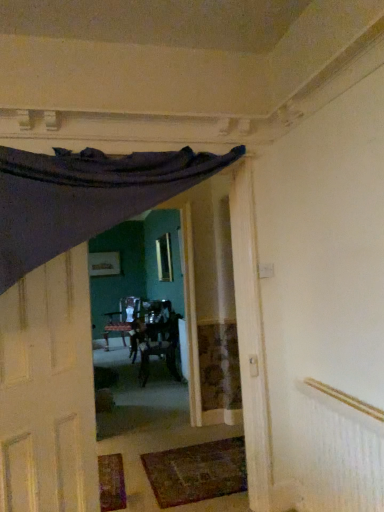
Question: Is matte white door at left surrounding wooden textured chair at center?

Choices:
 (A) yes
 (B) no

Answer: (B)

Question: Considering the relative sizes of matte white door at left and wooden textured chair at center in the image provided, is matte white door at left shorter than wooden textured chair at center?

Choices:
 (A) yes
 (B) no

Answer: (B)

Question: Considering the relative sizes of matte white door at left and wooden textured chair at center in the image provided, is matte white door at left smaller than wooden textured chair at center?

Choices:
 (A) no
 (B) yes

Answer: (B)

Question: From a real-world perspective, is matte white door at left on top of wooden textured chair at center?

Choices:
 (A) yes
 (B) no

Answer: (A)

Question: Does matte white door at left have a lesser width compared to wooden textured chair at center?

Choices:
 (A) yes
 (B) no

Answer: (A)

Question: From a real-world perspective, does matte white door at left sit lower than wooden textured chair at center?

Choices:
 (A) yes
 (B) no

Answer: (B)

Question: From a real-world perspective, is wooden textured chair at center over clear glass window at center?

Choices:
 (A) yes
 (B) no

Answer: (B)

Question: Can you confirm if wooden textured chair at center is taller than clear glass window at center?

Choices:
 (A) no
 (B) yes

Answer: (B)

Question: Is wooden textured chair at center in front of clear glass window at center?

Choices:
 (A) no
 (B) yes

Answer: (B)

Question: Is wooden textured chair at center outside of clear glass window at center?

Choices:
 (A) no
 (B) yes

Answer: (B)

Question: Considering the relative sizes of wooden textured chair at center and clear glass window at center in the image provided, is wooden textured chair at center thinner than clear glass window at center?

Choices:
 (A) no
 (B) yes

Answer: (A)

Question: Is wooden textured chair at center directly adjacent to clear glass window at center?

Choices:
 (A) yes
 (B) no

Answer: (B)

Question: Does dark brown woven mat at lower center have a greater width compared to white textured radiator at upper right?

Choices:
 (A) yes
 (B) no

Answer: (A)